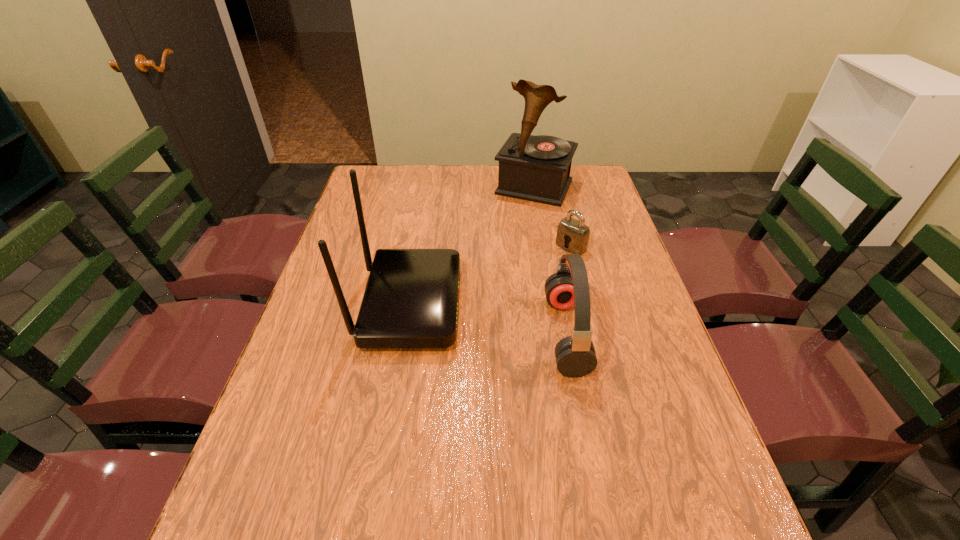
The image size is (960, 540). Find the location of `free area in between the phonograph_record and the leftmost object`. free area in between the phonograph_record and the leftmost object is located at coordinates (471, 246).

You are a GUI agent. You are given a task and a screenshot of the screen. Output one action in this format:
    pyautogui.click(x=<x>, y=<y>)
    Task: Click on the vacant area that lies between the farthest object and the shortest object
    Image resolution: width=960 pixels, height=540 pixels.
    Given the screenshot: What is the action you would take?
    pyautogui.click(x=553, y=217)

The height and width of the screenshot is (540, 960). In order to click on object that stands as the second closest to the third tallest object in this screenshot , I will do [411, 298].

Where is `object that is the nearest to the padlock`? object that is the nearest to the padlock is located at coordinates (537, 168).

Find the location of a particular element. free space that satisfies the following two spatial constraints: 1. on the front side of the phonograph_record; 2. on the right side of the shortest object is located at coordinates (544, 247).